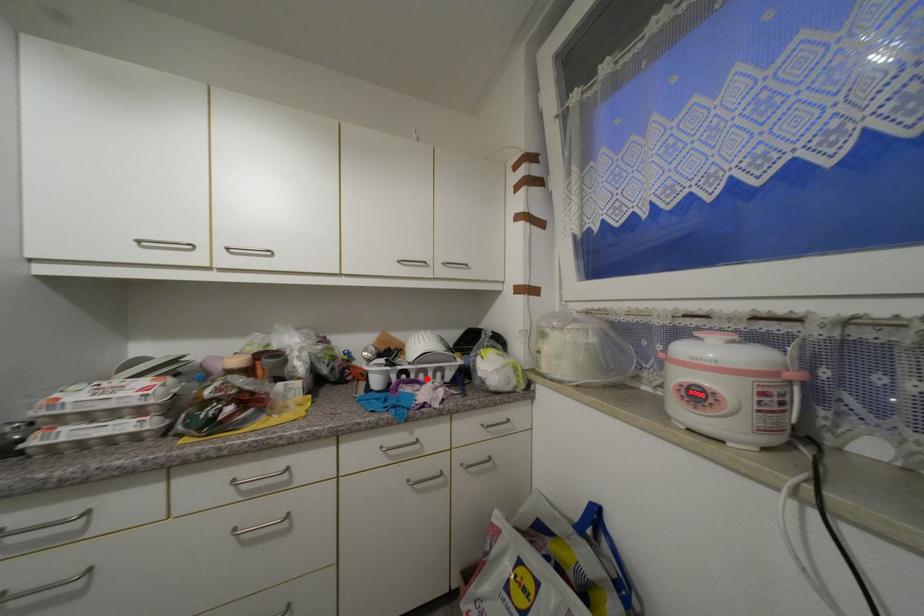
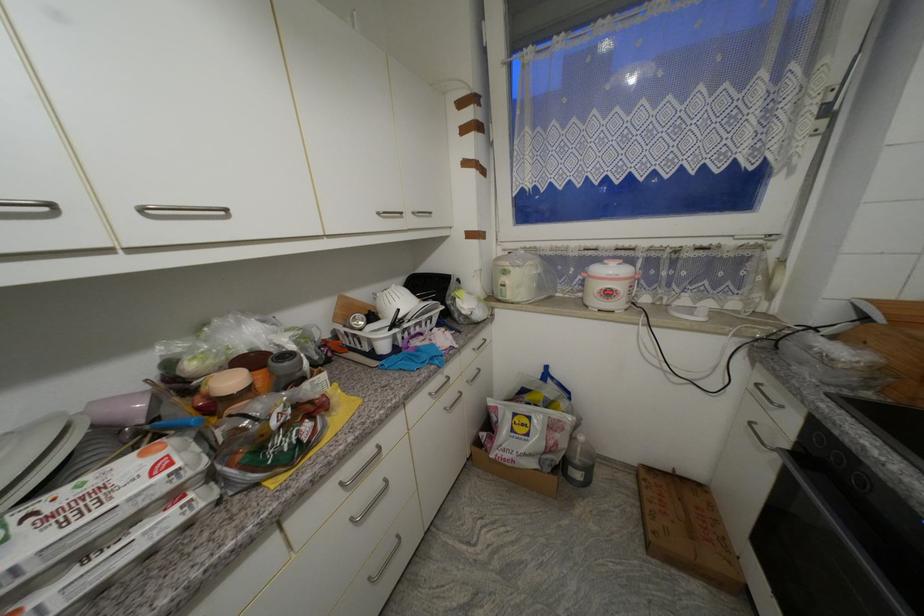
The point at the highlighted location is marked in the first image. Where is the corresponding point in the second image?

(423, 331)